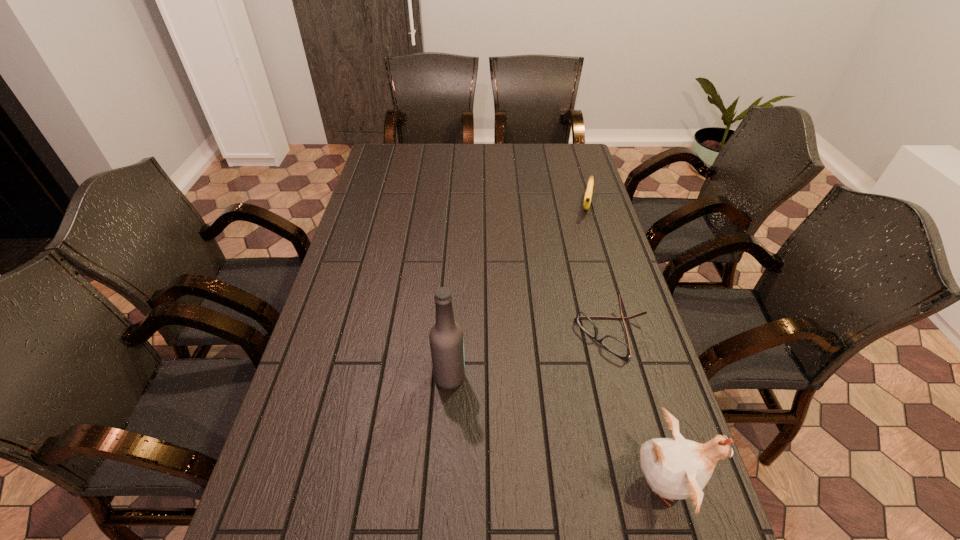
I want to click on free space on the desktop that is between the tallest object and the nearest object and is positioned on the front-facing side of the shortest object, so click(516, 410).

Find the location of a particular element. vacant spot on the desktop that is between the tallest object and the third shortest object and is positioned at the stem of the third tallest object is located at coordinates (549, 426).